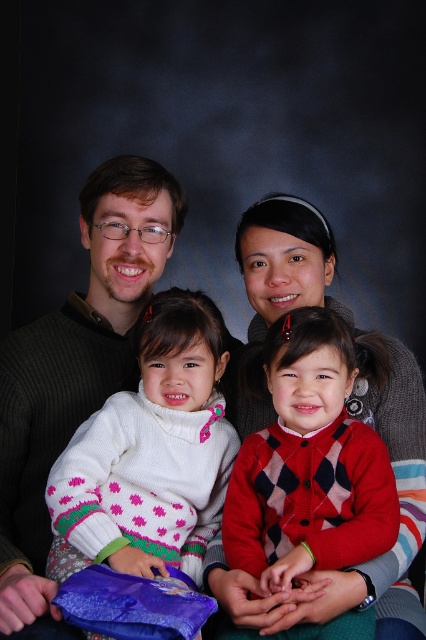
Which is in front, point (184, 397) or point (6, 566)?

Point (6, 566) is in front.

Who is positioned more to the left, white knitted sweater at center or dark gray sweater at left?

From the viewer's perspective, dark gray sweater at left appears more on the left side.

Who is more forward, (150, 540) or (17, 611)?

Point (17, 611) is in front.

Find the location of a particular element. The image size is (426, 640). white knitted sweater at center is located at coordinates (150, 452).

Is point (172, 552) in front of point (388, 467)?

No, it is not.

Consider the image. Does white knitted sweater at center appear over red argyle sweater at center?

Yes, white knitted sweater at center is above red argyle sweater at center.

Does point (172, 472) lie behind point (316, 387)?

Yes, it is.

Where is `white knitted sweater at center`? The width and height of the screenshot is (426, 640). white knitted sweater at center is located at coordinates (150, 452).

Is dark gray sweater at left further to camera compared to red argyle sweater at center?

Yes, it is behind red argyle sweater at center.

What do you see at coordinates (74, 368) in the screenshot? The width and height of the screenshot is (426, 640). I see `dark gray sweater at left` at bounding box center [74, 368].

The width and height of the screenshot is (426, 640). Identify the location of dark gray sweater at left. (74, 368).